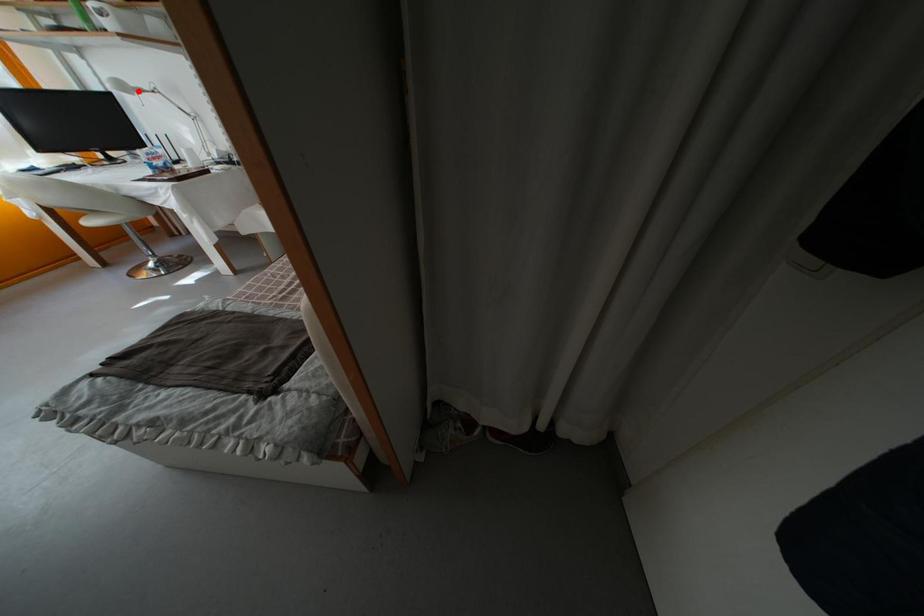
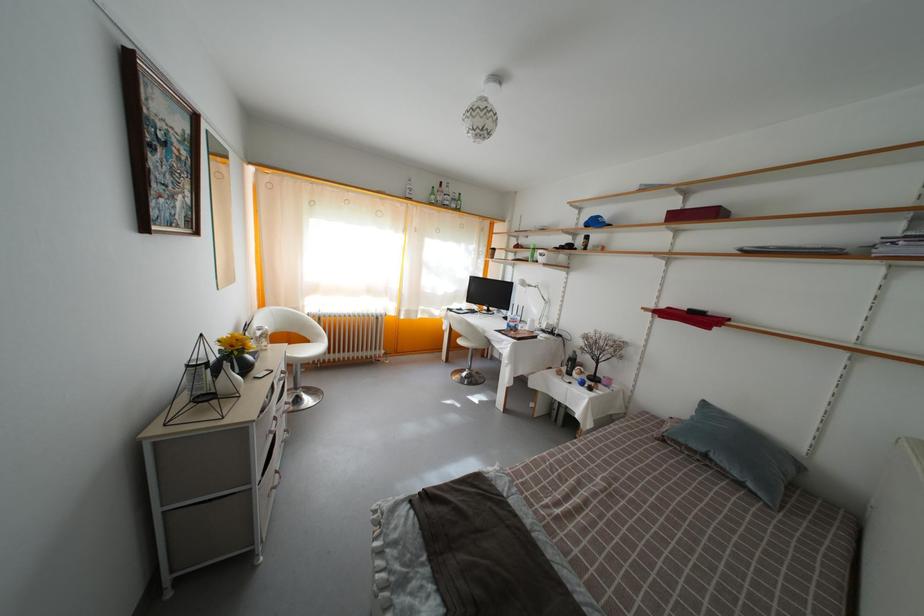
Where in the second image is the point corresponding to the highlighted location from the first image?

(533, 289)